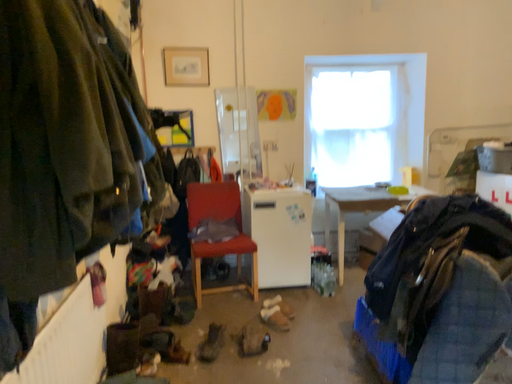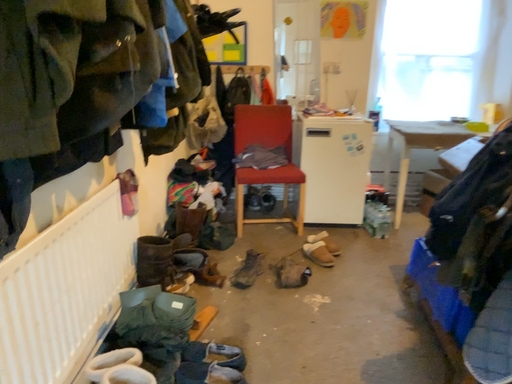
Question: Which way did the camera rotate in the video?

Choices:
 (A) rotated upward
 (B) rotated downward

Answer: (B)